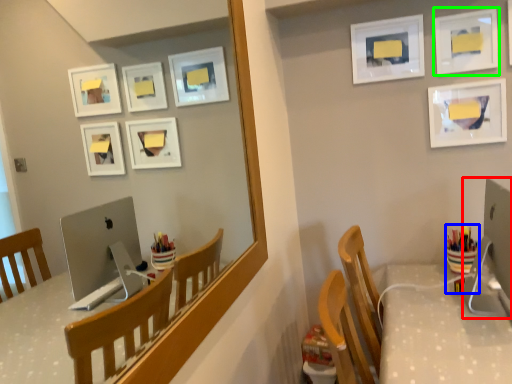
Question: Based on their relative distances, which object is farther from desktop computer (highlighted by a red box)? Choose from stationery (highlighted by a blue box) and picture frame (highlighted by a green box).

Choices:
 (A) stationery
 (B) picture frame

Answer: (B)